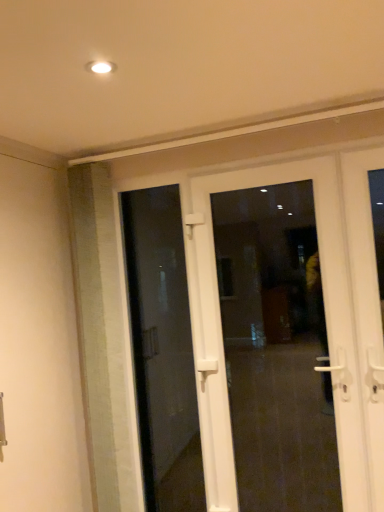
Question: Is transparent glass door at center, the second door viewed from the front, bigger than white plastic door at center, which is the second door in back-to-front order?

Choices:
 (A) no
 (B) yes

Answer: (A)

Question: From a real-world perspective, is transparent glass door at center, the second door viewed from the front, under white plastic door at center, the 1th door positioned from the front?

Choices:
 (A) yes
 (B) no

Answer: (B)

Question: From the image's perspective, is transparent glass door at center, the 1th door when ordered from back to front, under white plastic door at center, the 1th door positioned from the front?

Choices:
 (A) no
 (B) yes

Answer: (A)

Question: Is transparent glass door at center, the second door viewed from the front, smaller than white plastic door at center, the 1th door positioned from the front?

Choices:
 (A) yes
 (B) no

Answer: (A)

Question: Is transparent glass door at center, the 1th door when ordered from back to front, positioned far away from white plastic door at center, which is the second door in back-to-front order?

Choices:
 (A) no
 (B) yes

Answer: (A)

Question: From the image's perspective, is transparent glass door at center, the 1th door when ordered from back to front, on top of white plastic door at center, which is the second door in back-to-front order?

Choices:
 (A) yes
 (B) no

Answer: (A)

Question: Are white plastic door at center, the 1th door positioned from the front, and transparent glass door at center, the 1th door when ordered from back to front, far apart?

Choices:
 (A) yes
 (B) no

Answer: (B)

Question: Can you confirm if white plastic door at center, which is the second door in back-to-front order, is wider than transparent glass door at center, the second door viewed from the front?

Choices:
 (A) no
 (B) yes

Answer: (B)

Question: Is white plastic door at center, which is the second door in back-to-front order, not inside transparent glass door at center, the second door viewed from the front?

Choices:
 (A) yes
 (B) no

Answer: (A)

Question: From a real-world perspective, is white plastic door at center, which is the second door in back-to-front order, on top of transparent glass door at center, the 1th door when ordered from back to front?

Choices:
 (A) yes
 (B) no

Answer: (B)

Question: Does white plastic door at center, the 1th door positioned from the front, have a greater height compared to transparent glass door at center, the 1th door when ordered from back to front?

Choices:
 (A) no
 (B) yes

Answer: (A)

Question: Can you confirm if white plastic door at center, which is the second door in back-to-front order, is shorter than transparent glass door at center, the second door viewed from the front?

Choices:
 (A) yes
 (B) no

Answer: (A)

Question: From a real-world perspective, relative to white plastic door at center, which is the second door in back-to-front order, is transparent glass door at center, the second door viewed from the front, vertically above or below?

Choices:
 (A) below
 (B) above

Answer: (B)